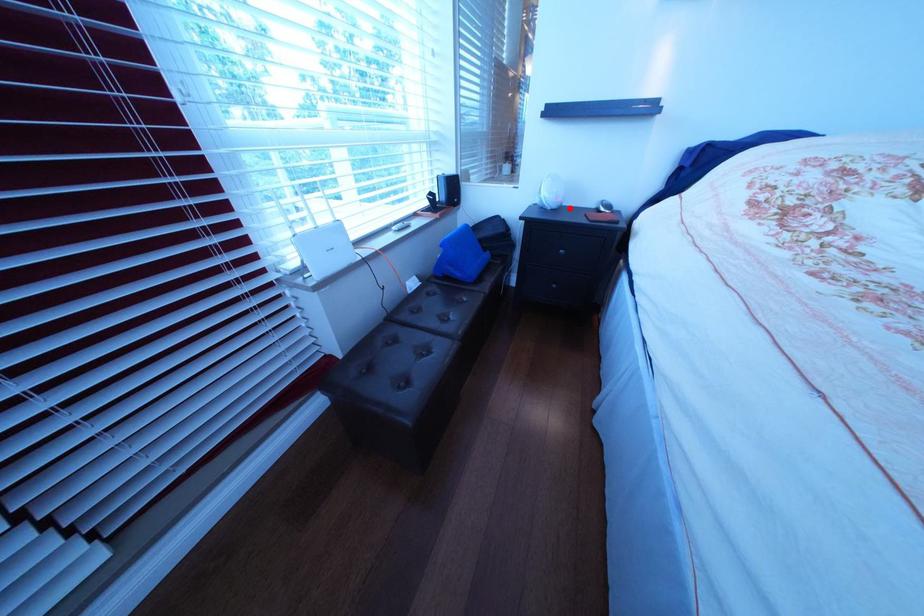
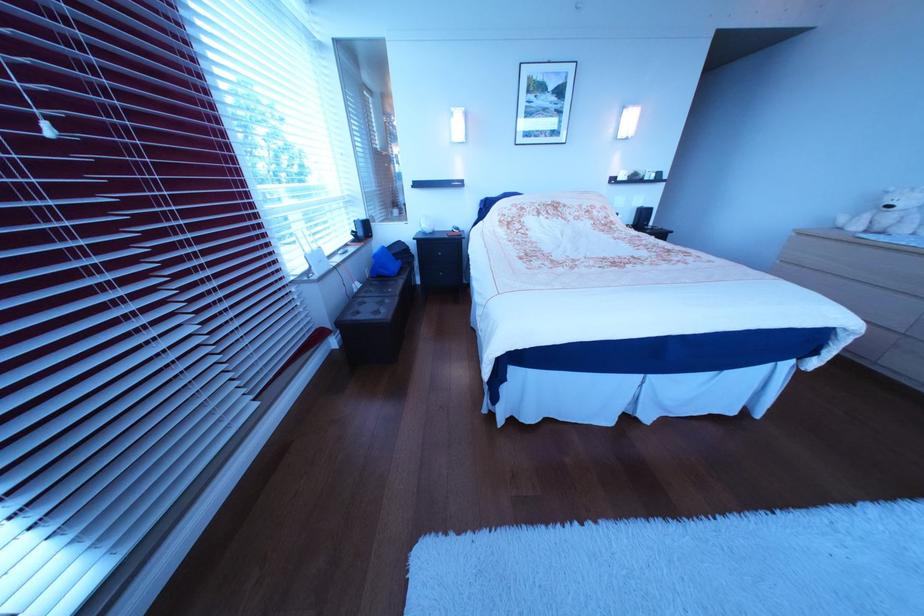
Question: I am providing you with two images of the same scene from different viewpoints. A red point is shown in image1. For the corresponding object point in image2, is it positioned nearer or farther from the camera?

Choices:
 (A) Nearer
 (B) Farther

Answer: (A)